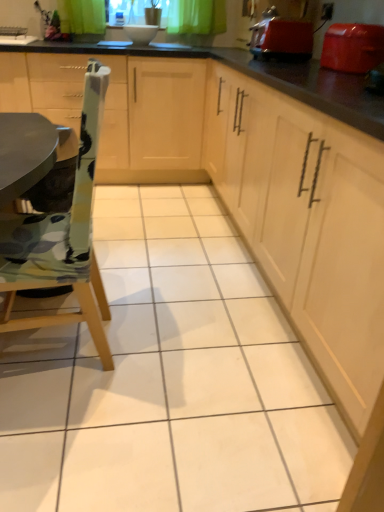
Question: Considering the positions of point (342, 42) and point (134, 69), is point (342, 42) closer or farther from the camera than point (134, 69)?

Choices:
 (A) closer
 (B) farther

Answer: (A)

Question: Considering their positions, is shiny plastic toaster at upper right, which appears as the first appliance when viewed from the front, located in front of or behind matte wood cabinets at center, the second cabinetry in the right-to-left sequence?

Choices:
 (A) behind
 (B) front

Answer: (B)

Question: Which of these objects is positioned closest to the matte wood cabinets at center, the second cabinetry in the right-to-left sequence?

Choices:
 (A) wooden chair at left
 (B) shiny plastic toaster at upper right, which appears as the first appliance when viewed from the front
 (C) matte red toaster at upper right, the first appliance in the back-to-front sequence
 (D) light wood cabinet at center, arranged as the first cabinetry when viewed from the right

Answer: (C)

Question: Which of these objects is positioned closest to the matte wood cabinets at center, which is the 1th cabinetry in left-to-right order?

Choices:
 (A) light wood cabinet at center, arranged as the first cabinetry when viewed from the right
 (B) shiny plastic toaster at upper right, the 2th appliance in the left-to-right sequence
 (C) wooden chair at left
 (D) matte red toaster at upper right, which is the 2th appliance in front-to-back order

Answer: (D)